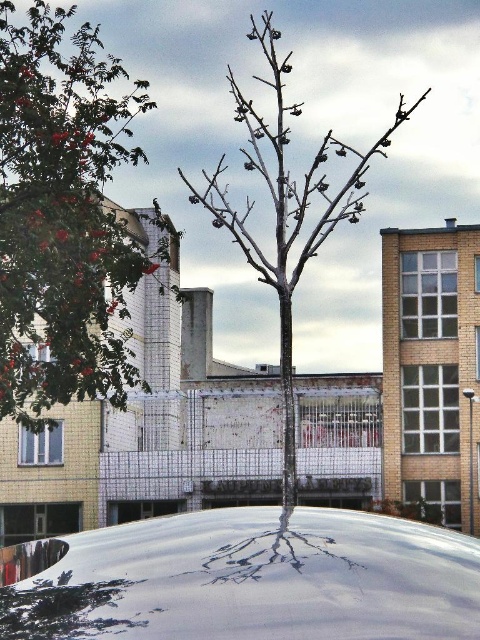
Does red glossy tree at upper left appear over smooth gray tree at center?

Correct, red glossy tree at upper left is located above smooth gray tree at center.

Between red glossy tree at upper left and smooth gray tree at center, which one appears on the right side from the viewer's perspective?

Positioned to the right is smooth gray tree at center.

Image resolution: width=480 pixels, height=640 pixels. I want to click on red glossy tree at upper left, so click(x=62, y=218).

Does white glossy car at center lie behind smooth gray tree at center?

No, it is in front of smooth gray tree at center.

Where is `white glossy car at center`? This screenshot has width=480, height=640. white glossy car at center is located at coordinates (248, 579).

Can you confirm if white glossy car at center is smaller than red glossy tree at upper left?

Indeed, white glossy car at center has a smaller size compared to red glossy tree at upper left.

Is point (108, 556) farther from camera compared to point (28, 349)?

That is False.

The width and height of the screenshot is (480, 640). I want to click on white glossy car at center, so click(248, 579).